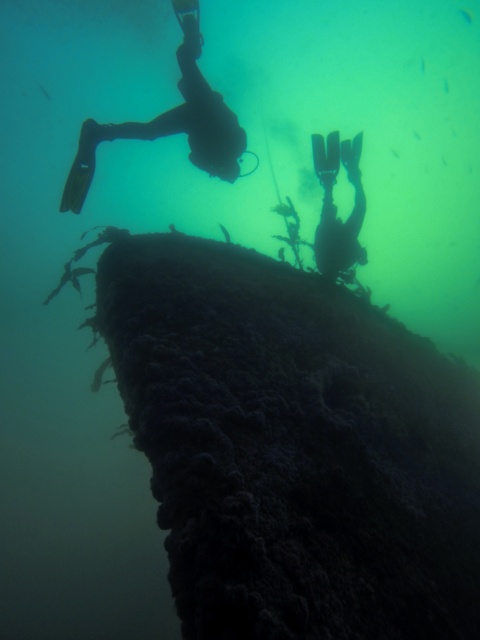
You are a marine biologist preparing to dive into the underwater scene described. You need to place a 1.20 meter long measuring tape between the black matte scuba diver at upper left and the silhouette flippers at center. Will the tape be long enough to reach between them?

The black matte scuba diver at upper left is 1.30 meters away from the silhouette flippers at center. Since the measuring tape is only 1.20 meters long, it will not be long enough to reach between them.

You are a marine biologist observing the underwater scene. You notice the black matte scuba diver at upper left and the silhouette flippers at center. Which object is taller?

The black matte scuba diver at upper left is taller than the silhouette flippers at center.